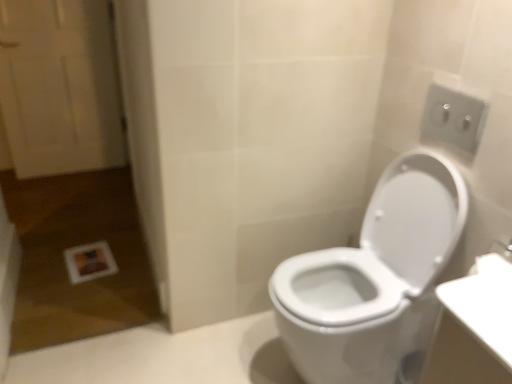
I want to click on vacant space underneath white wooden door at left (from a real-world perspective), so click(75, 167).